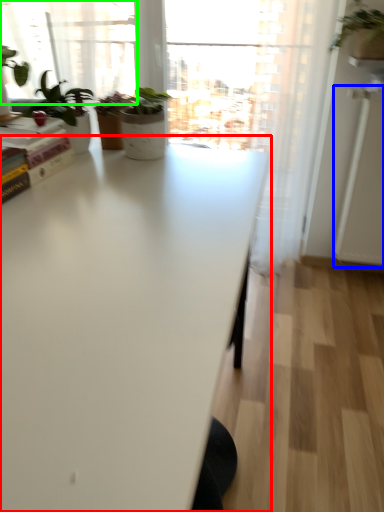
Question: Which object is positioned farthest from table (highlighted by a red box)? Select from screen door (highlighted by a blue box) and bay window (highlighted by a green box).

Choices:
 (A) screen door
 (B) bay window

Answer: (B)